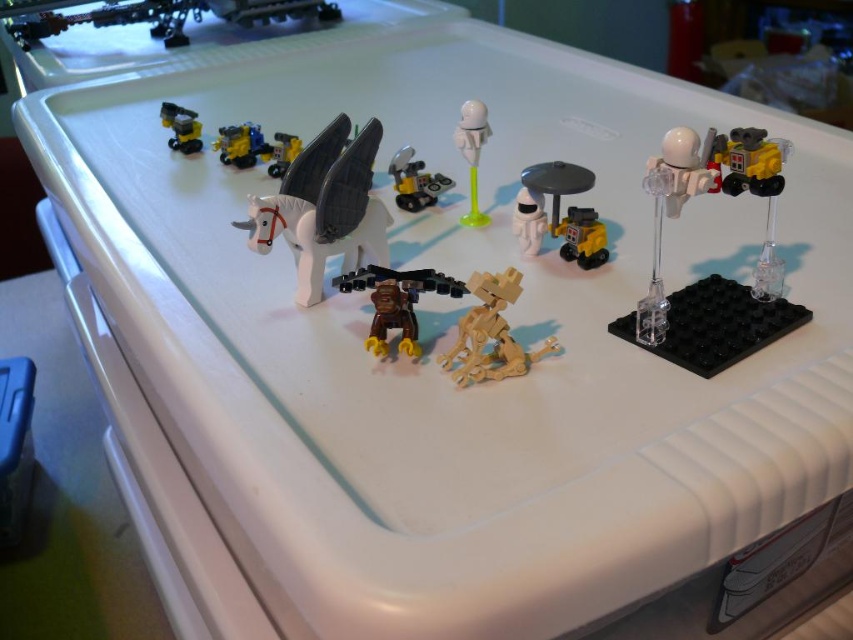
Question: Is wooden figure at center below translucent white plastic astronaut at center?

Choices:
 (A) yes
 (B) no

Answer: (A)

Question: Is clear plastic robot at upper right closer to camera compared to metallic yellow and blue vehicle at upper left?

Choices:
 (A) yes
 (B) no

Answer: (A)

Question: Among these points, which one is farthest from the camera?

Choices:
 (A) (575, 227)
 (B) (567, 211)
 (C) (379, 323)
 (D) (474, 205)

Answer: (D)

Question: Which point is closer to the camera?

Choices:
 (A) metallic yellow and black vehicle at upper left
 (B) yellow plastic truck at center
 (C) wooden figure at center

Answer: (C)

Question: Which object is positioned farthest from the yellow plastic robot at upper right?

Choices:
 (A) shiny yellow plastic robot at upper left
 (B) wooden figure at center

Answer: (A)

Question: Can you confirm if metallic yellow and blue vehicle at upper left is positioned to the left of metallic yellow and black vehicle at upper left?

Choices:
 (A) no
 (B) yes

Answer: (A)